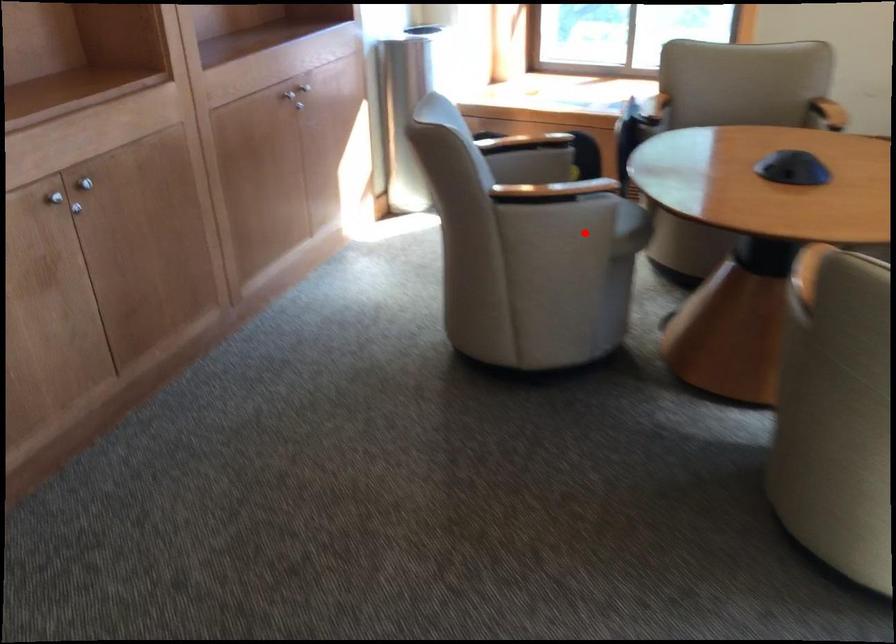
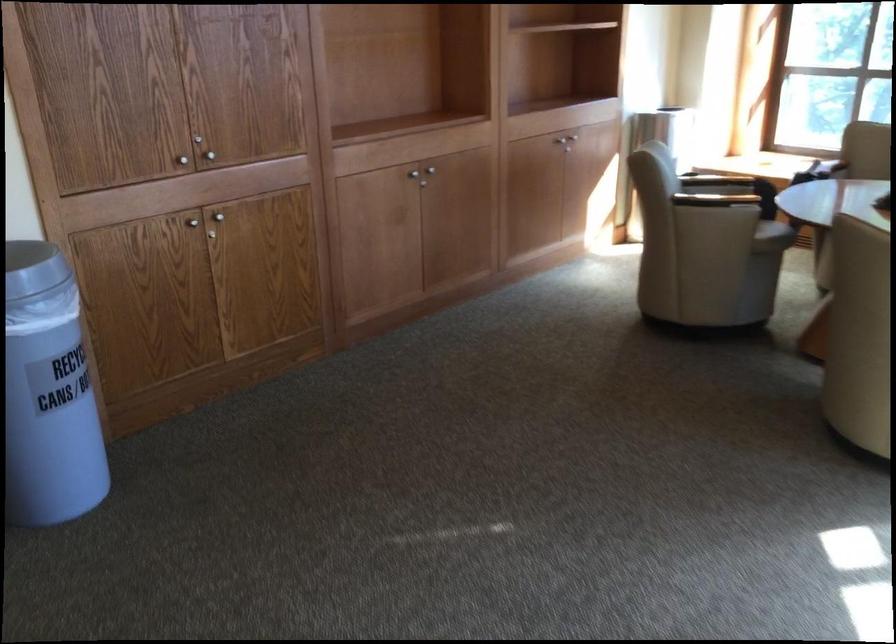
Question: I am providing you with two images of the same scene from different viewpoints. Image1 has a red point marked. In image2, the corresponding 3D location appears at what relative position? Reply with the corresponding letter.

Choices:
 (A) Closer
 (B) Farther

Answer: (B)